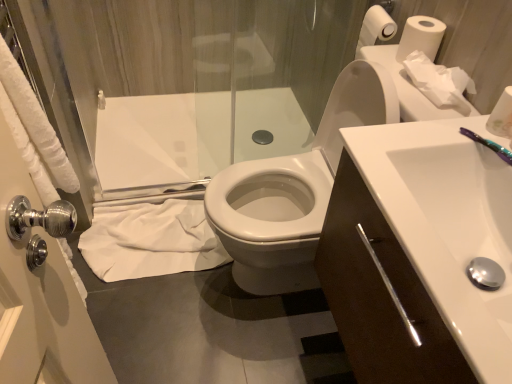
Image resolution: width=512 pixels, height=384 pixels. I want to click on free location in front of white matte toilet paper at upper right, which is counted as the 3th toilet paper, starting from the bottom, so click(x=400, y=90).